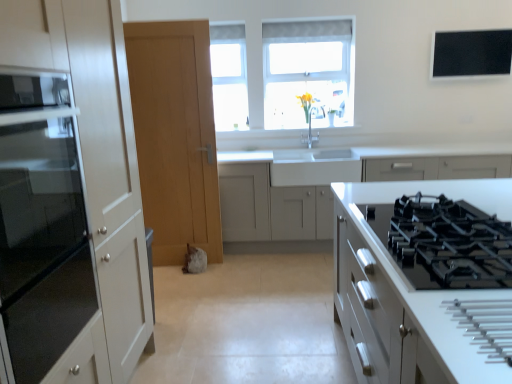
Question: Is clear glass window at upper center to the right of light wood door at center from the viewer's perspective?

Choices:
 (A) no
 (B) yes

Answer: (B)

Question: From a real-world perspective, is clear glass window at upper center on light wood door at center?

Choices:
 (A) yes
 (B) no

Answer: (A)

Question: Is clear glass window at upper center not near light wood door at center?

Choices:
 (A) yes
 (B) no

Answer: (B)

Question: Can you confirm if clear glass window at upper center is wider than light wood door at center?

Choices:
 (A) yes
 (B) no

Answer: (B)

Question: Can you confirm if clear glass window at upper center is taller than light wood door at center?

Choices:
 (A) no
 (B) yes

Answer: (A)

Question: From a real-world perspective, is matte glass cabinet at left, positioned as the second cabinetry in front-to-back order, physically located above or below black glass gas stove at center right?

Choices:
 (A) below
 (B) above

Answer: (B)

Question: From the image's perspective, is matte glass cabinet at left, positioned as the second cabinetry in front-to-back order, above or below black glass gas stove at center right?

Choices:
 (A) above
 (B) below

Answer: (A)

Question: Is matte glass cabinet at left, the second cabinetry in the back-to-front sequence, wider or thinner than black glass gas stove at center right?

Choices:
 (A) wide
 (B) thin

Answer: (B)

Question: Considering the positions of point (80, 200) and point (414, 281), is point (80, 200) closer or farther from the camera than point (414, 281)?

Choices:
 (A) farther
 (B) closer

Answer: (A)

Question: Visually, is black glass gas stove at center right positioned to the left or to the right of clear glass window at upper center?

Choices:
 (A) right
 (B) left

Answer: (A)

Question: In terms of height, does black glass gas stove at center right look taller or shorter compared to clear glass window at upper center?

Choices:
 (A) tall
 (B) short

Answer: (B)

Question: Is point (434, 281) closer or farther from the camera than point (222, 48)?

Choices:
 (A) farther
 (B) closer

Answer: (B)

Question: Looking at their shapes, would you say black glass gas stove at center right is wider or thinner than clear glass window at upper center?

Choices:
 (A) wide
 (B) thin

Answer: (A)

Question: In the image, is black matte window screen at upper right positioned in front of or behind white matte cabinet at center, which appears as the 1th cabinetry when viewed from the back?

Choices:
 (A) front
 (B) behind

Answer: (B)

Question: In the image, is black matte window screen at upper right on the left side or the right side of white matte cabinet at center, the 3th cabinetry when ordered from front to back?

Choices:
 (A) right
 (B) left

Answer: (A)